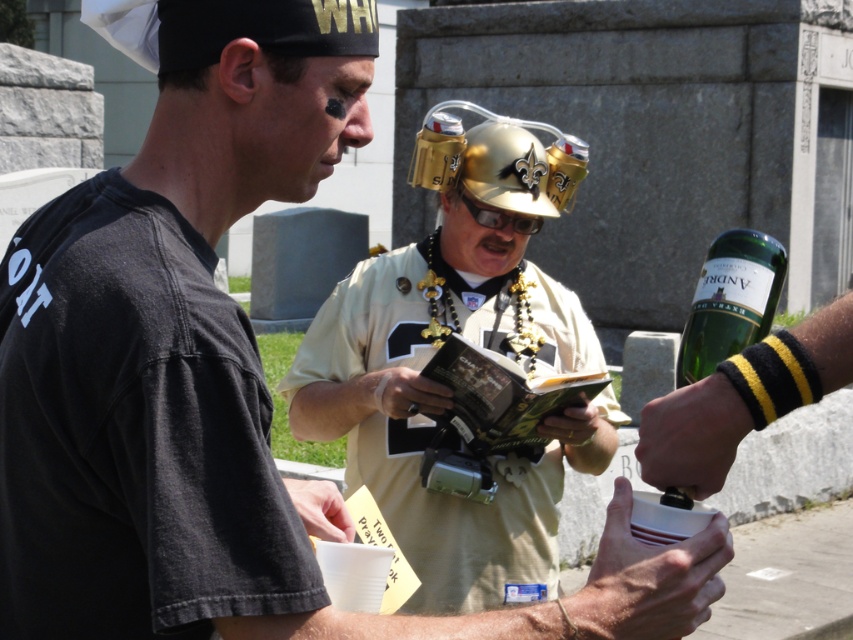
Based on the photo, is gold metallic helmet at center to the left of green glass bottle at upper right from the viewer's perspective?

Indeed, gold metallic helmet at center is positioned on the left side of green glass bottle at upper right.

Where is `gold metallic helmet at center`? gold metallic helmet at center is located at coordinates (467, 339).